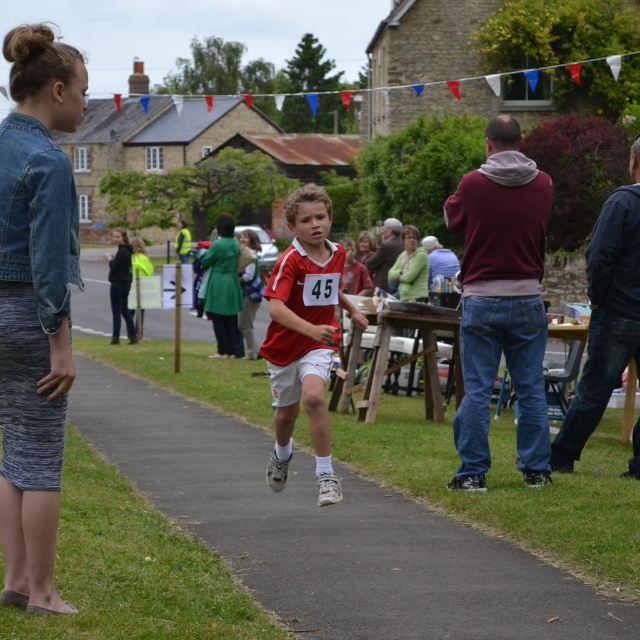
Question: Is matte red jersey at center further to the viewer compared to green fabric coat at left?

Choices:
 (A) yes
 (B) no

Answer: (B)

Question: Is black asphalt pavement at center positioned at the back of matte red jersey at center?

Choices:
 (A) yes
 (B) no

Answer: (B)

Question: Which point appears farthest from the camera in this image?

Choices:
 (A) (532, 620)
 (B) (493, 340)
 (C) (360, 324)

Answer: (B)

Question: Can you confirm if black asphalt pavement at center is positioned to the left of green fabric coat at left?

Choices:
 (A) yes
 (B) no

Answer: (B)

Question: Which of these objects is positioned closest to the green fabric coat at center?

Choices:
 (A) denim jacket at left
 (B) black asphalt pavement at center
 (C) maroon hoodie at center
 (D) green fabric coat at left

Answer: (D)

Question: Which of the following is the farthest from the observer?

Choices:
 (A) (500, 296)
 (B) (17, 465)
 (C) (326, 312)

Answer: (A)